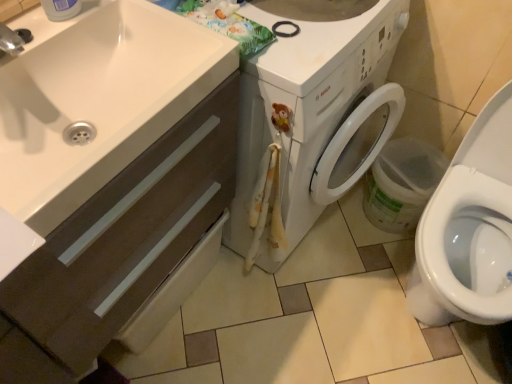
Question: Is white glossy toilet at lower right positioned behind white glossy sink at lower left?

Choices:
 (A) yes
 (B) no

Answer: (A)

Question: Is white glossy sink at lower left surrounded by white glossy toilet at lower right?

Choices:
 (A) yes
 (B) no

Answer: (B)

Question: From a real-world perspective, is white glossy toilet at lower right on top of white glossy sink at lower left?

Choices:
 (A) yes
 (B) no

Answer: (B)

Question: From a real-world perspective, is white glossy toilet at lower right beneath white glossy sink at lower left?

Choices:
 (A) yes
 (B) no

Answer: (A)

Question: Considering the relative sizes of white glossy toilet at lower right and white glossy sink at lower left in the image provided, is white glossy toilet at lower right thinner than white glossy sink at lower left?

Choices:
 (A) no
 (B) yes

Answer: (A)

Question: From the image's perspective, would you say white glossy toilet at lower right is shown under white glossy sink at lower left?

Choices:
 (A) no
 (B) yes

Answer: (B)

Question: From a real-world perspective, is white glossy washing machine at center located higher than matte brown cabinet at lower left?

Choices:
 (A) no
 (B) yes

Answer: (A)

Question: Is white glossy washing machine at center smaller than matte brown cabinet at lower left?

Choices:
 (A) no
 (B) yes

Answer: (A)

Question: Is white glossy washing machine at center to the left of matte brown cabinet at lower left from the viewer's perspective?

Choices:
 (A) yes
 (B) no

Answer: (B)

Question: Considering the relative sizes of white glossy washing machine at center and matte brown cabinet at lower left in the image provided, is white glossy washing machine at center thinner than matte brown cabinet at lower left?

Choices:
 (A) yes
 (B) no

Answer: (B)

Question: Considering the relative sizes of white glossy washing machine at center and matte brown cabinet at lower left in the image provided, is white glossy washing machine at center shorter than matte brown cabinet at lower left?

Choices:
 (A) no
 (B) yes

Answer: (B)

Question: Are white glossy washing machine at center and matte brown cabinet at lower left making contact?

Choices:
 (A) yes
 (B) no

Answer: (B)

Question: Is white glossy sink at lower left next to matte brown cabinet at lower left and touching it?

Choices:
 (A) yes
 (B) no

Answer: (B)